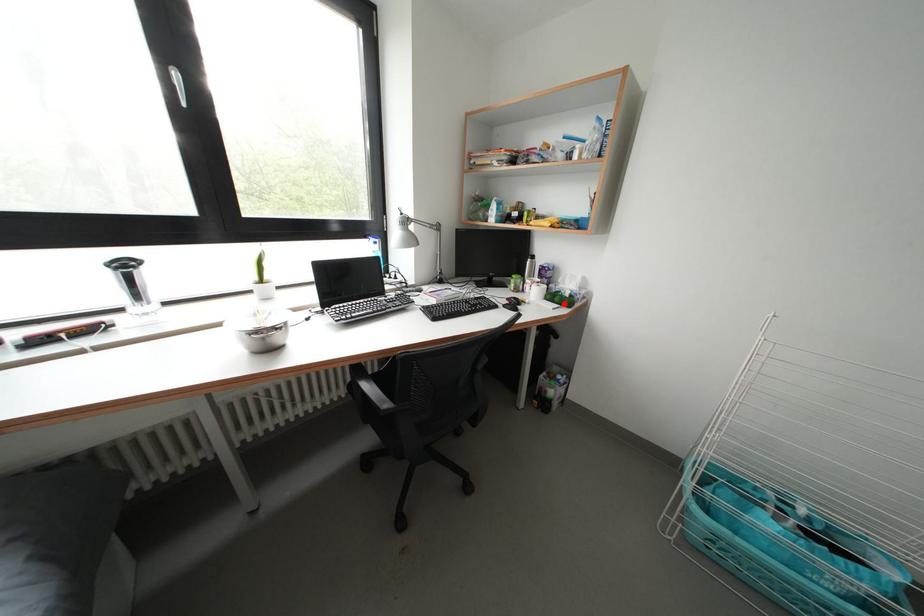
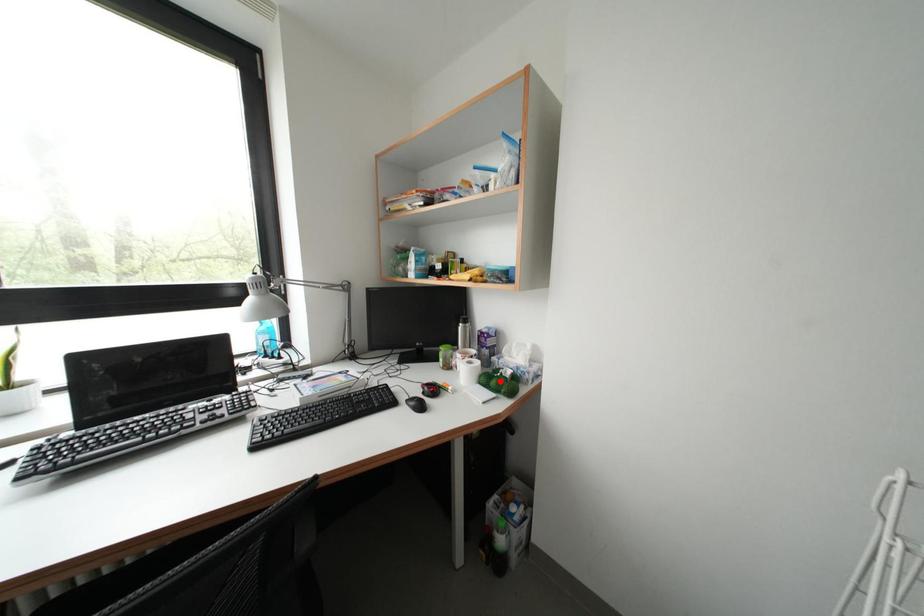
I am providing you with two images of the same scene from different viewpoints. A red point is marked on the first image and another point is marked on the second image. Does the point marked in image1 correspond to the same location as the one in image2?

No